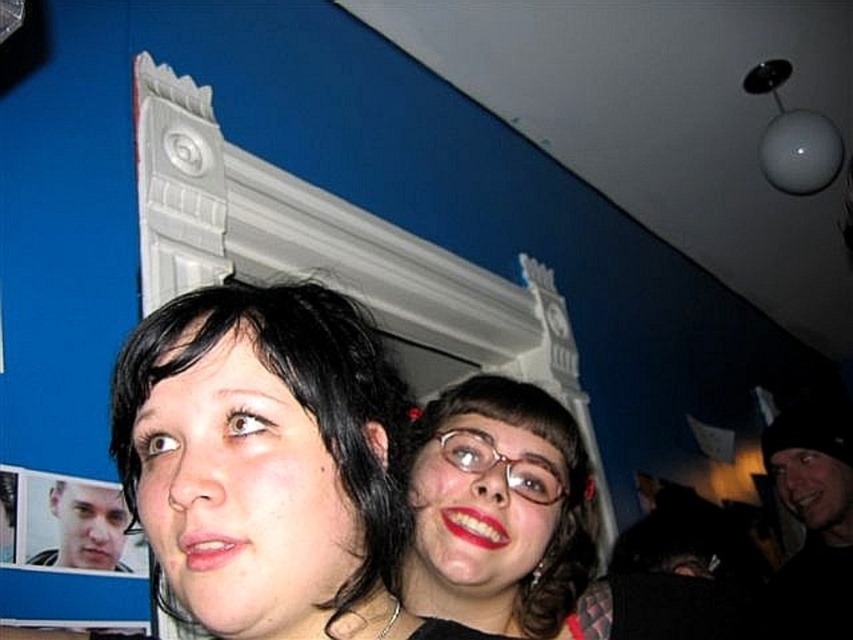
Question: Which is nearer to the dark gray knit hat at right?

Choices:
 (A) smooth skin face at lower left
 (B) matte black glasses at center
 (C) smooth skin face at center

Answer: (B)

Question: Considering the relative positions of dark gray knit hat at right and glossy matte lipstick at lower right in the image provided, where is dark gray knit hat at right located with respect to glossy matte lipstick at lower right?

Choices:
 (A) right
 (B) left

Answer: (A)

Question: Which object appears closest to the camera in this image?

Choices:
 (A) smooth skin face at center
 (B) glossy matte lipstick at lower right

Answer: (A)

Question: Is smooth skin face at center further to camera compared to smooth skin face at lower left?

Choices:
 (A) yes
 (B) no

Answer: (B)

Question: Among these objects, which one is farthest from the camera?

Choices:
 (A) smooth skin face at center
 (B) dark gray knit hat at right
 (C) glossy matte lipstick at lower right
 (D) matte red lipstick at lower center

Answer: (B)

Question: Can you confirm if smooth skin face at lower left is wider than glossy matte lipstick at lower right?

Choices:
 (A) no
 (B) yes

Answer: (B)